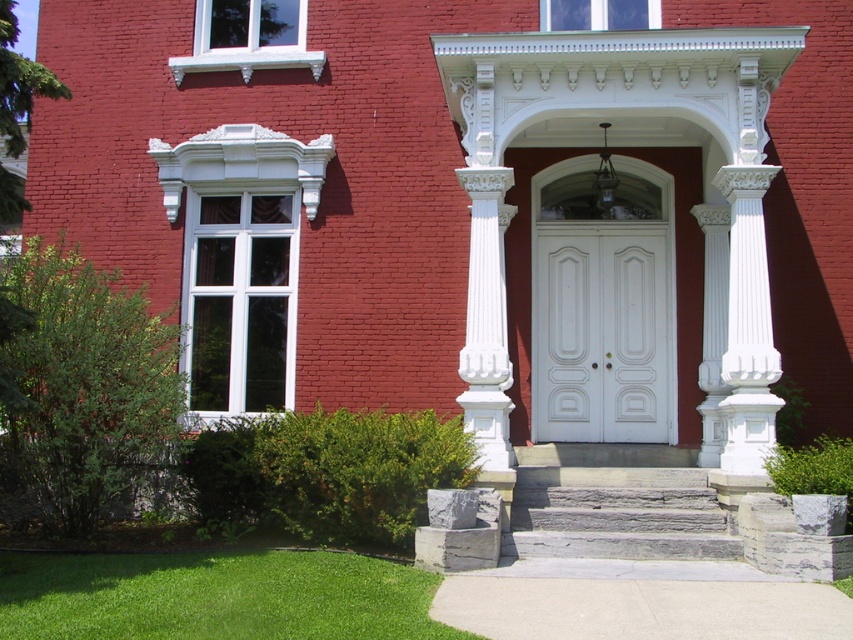
Which is more to the left, white smooth door at center or gray stone stairs at center?

Positioned to the left is gray stone stairs at center.

The width and height of the screenshot is (853, 640). What do you see at coordinates (601, 332) in the screenshot?
I see `white smooth door at center` at bounding box center [601, 332].

Does point (595, 401) come closer to viewer compared to point (693, 552)?

No, (595, 401) is behind (693, 552).

Locate an element on the screen. white smooth door at center is located at coordinates (601, 332).

Can you confirm if green grass at lower left is smaller than gray stone stairs at center?

No.

Is green grass at lower left positioned before gray stone stairs at center?

Yes, it is.

Find the location of a particular element. The image size is (853, 640). green grass at lower left is located at coordinates (216, 596).

Which is more to the left, green grass at lower left or white smooth door at center?

green grass at lower left is more to the left.

Is green grass at lower left wider than white smooth door at center?

Correct, the width of green grass at lower left exceeds that of white smooth door at center.

The image size is (853, 640). Find the location of `green grass at lower left`. green grass at lower left is located at coordinates (216, 596).